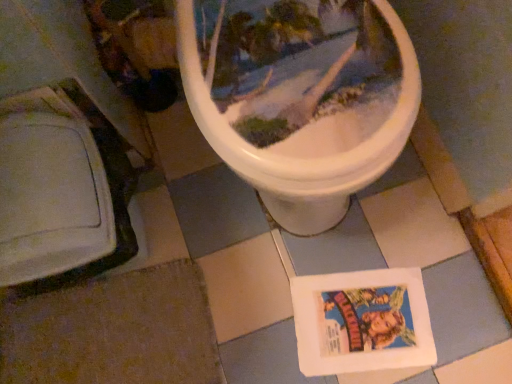
Question: Looking at the image, does white paper comic book at lower center seem bigger or smaller compared to brown fabric at lower left?

Choices:
 (A) big
 (B) small

Answer: (B)

Question: Is point (298, 281) positioned closer to the camera than point (55, 349)?

Choices:
 (A) farther
 (B) closer

Answer: (A)

Question: From a real-world perspective, relative to brown fabric at lower left, is white paper comic book at lower center vertically above or below?

Choices:
 (A) below
 (B) above

Answer: (A)

Question: Considering the relative positions of brown fabric at lower left and white paper comic book at lower center in the image provided, is brown fabric at lower left to the left or to the right of white paper comic book at lower center?

Choices:
 (A) right
 (B) left

Answer: (B)

Question: From the image's perspective, is brown fabric at lower left above or below white paper comic book at lower center?

Choices:
 (A) below
 (B) above

Answer: (A)

Question: Is brown fabric at lower left wider or thinner than white paper comic book at lower center?

Choices:
 (A) wide
 (B) thin

Answer: (A)

Question: Is point (169, 362) closer or farther from the camera than point (390, 336)?

Choices:
 (A) closer
 (B) farther

Answer: (B)